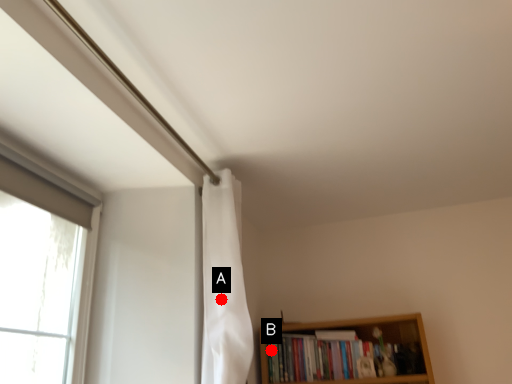
Question: Two points are circled on the image, labeled by A and B beside each circle. Among these points, which one is nearest to the camera?

Choices:
 (A) A is closer
 (B) B is closer

Answer: (A)